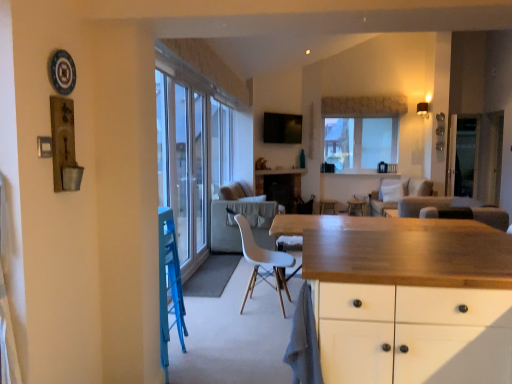
Question: Would you say transparent glass door at right is outside beige fabric couch at center, the first couch positioned from the back?

Choices:
 (A) yes
 (B) no

Answer: (A)

Question: Considering the relative sizes of transparent glass door at right and beige fabric couch at center, positioned as the second couch in front-to-back order, in the image provided, is transparent glass door at right smaller than beige fabric couch at center, positioned as the second couch in front-to-back order,?

Choices:
 (A) yes
 (B) no

Answer: (A)

Question: Is beige fabric couch at center, positioned as the second couch in front-to-back order, at the back of transparent glass door at right?

Choices:
 (A) yes
 (B) no

Answer: (A)

Question: Are transparent glass door at right and beige fabric couch at center, the first couch positioned from the back, far apart?

Choices:
 (A) no
 (B) yes

Answer: (A)

Question: Can you confirm if transparent glass door at right is shorter than beige fabric couch at center, the first couch positioned from the back?

Choices:
 (A) yes
 (B) no

Answer: (B)

Question: Considering the positions of wooden countertop at center and beige fabric couch at center, positioned as the second couch in front-to-back order, in the image, is wooden countertop at center taller or shorter than beige fabric couch at center, positioned as the second couch in front-to-back order,?

Choices:
 (A) tall
 (B) short

Answer: (B)

Question: From a real-world perspective, is wooden countertop at center above or below beige fabric couch at center, the first couch positioned from the back?

Choices:
 (A) above
 (B) below

Answer: (A)

Question: Looking at their shapes, would you say wooden countertop at center is wider or thinner than beige fabric couch at center, the first couch positioned from the back?

Choices:
 (A) thin
 (B) wide

Answer: (A)

Question: Would you say wooden countertop at center is inside or outside beige fabric couch at center, positioned as the second couch in front-to-back order?

Choices:
 (A) inside
 (B) outside

Answer: (B)

Question: Considering the positions of point (262, 168) and point (278, 173), is point (262, 168) closer or farther from the camera than point (278, 173)?

Choices:
 (A) farther
 (B) closer

Answer: (A)

Question: From the image's perspective, is wooden countertop at center located above or below wooden countertop at center?

Choices:
 (A) below
 (B) above

Answer: (B)

Question: Looking at their shapes, would you say wooden countertop at center is wider or thinner than wooden countertop at center?

Choices:
 (A) thin
 (B) wide

Answer: (A)

Question: From a real-world perspective, is wooden countertop at center above or below wooden countertop at center?

Choices:
 (A) below
 (B) above

Answer: (B)

Question: In terms of size, does dark brown leather armchair at center appear bigger or smaller than beige fabric couch at center, the first couch positioned from the back?

Choices:
 (A) small
 (B) big

Answer: (A)

Question: Is point (470, 208) positioned closer to the camera than point (394, 192)?

Choices:
 (A) closer
 (B) farther

Answer: (A)